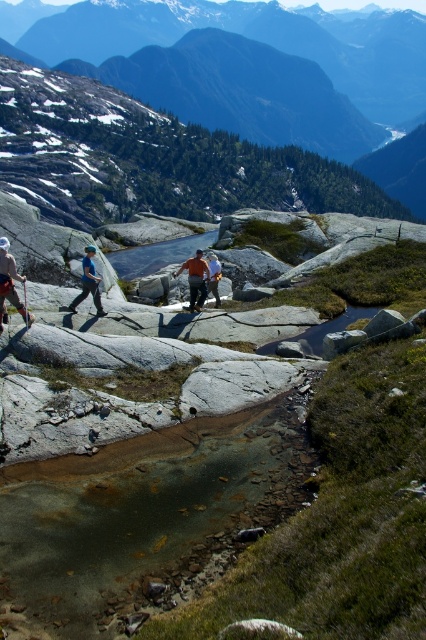
You are a hiker trying to navigate the trail. You see the green grassy mountain at upper center and the matte blue jacket at left. Which object is located to the right of the other?

The green grassy mountain at upper center is positioned to the right of the matte blue jacket at left.

You are a photographer trying to capture a group of hikers in the middle of a scenic trail. You notice two hikers wearing an orange shirt at center and a brown leather jacket at center. Which hiker should you focus on to ensure the subject appears larger in your photo?

The orange shirt at center is larger in size than the brown leather jacket at center, so focusing on the orange shirt at center will make the subject appear larger in the photo.

You are a hiker on the trail and notice two items in the center area. Which item is positioned to the left when looking at the blue fabric pants at center and the brown leather jacket at center?

The blue fabric pants at center are to the left of the brown leather jacket at center.